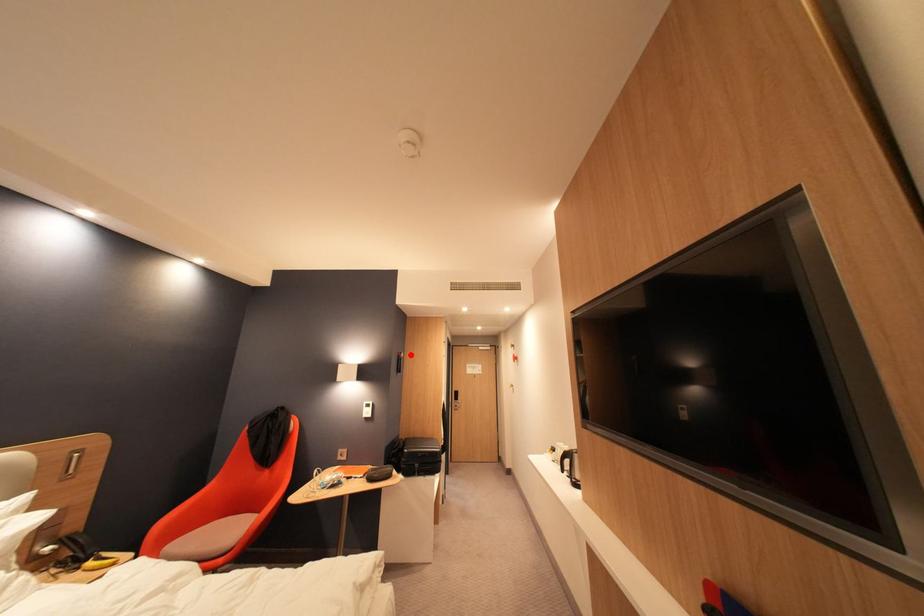
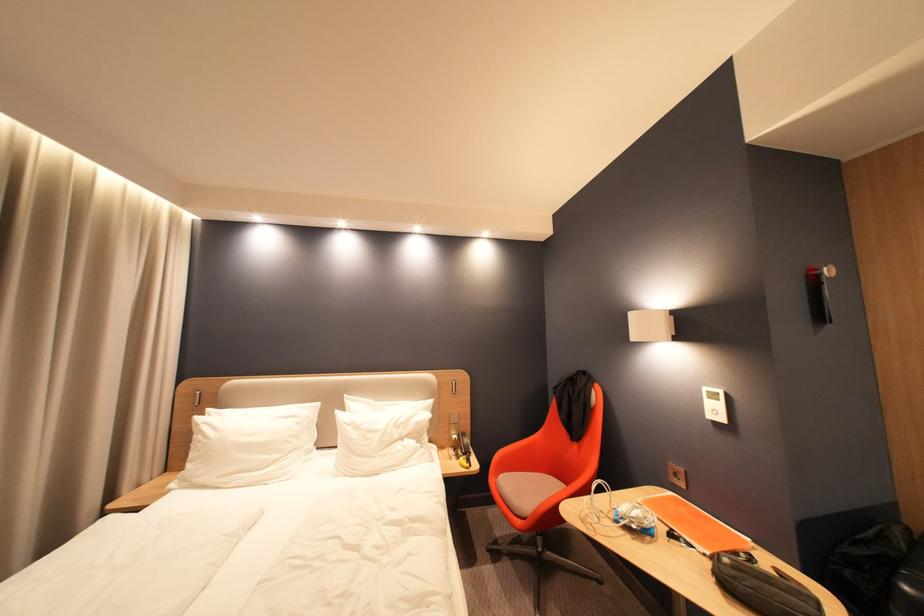
Where in the second image is the point corresponding to the highlighted location from the first image?

(830, 270)